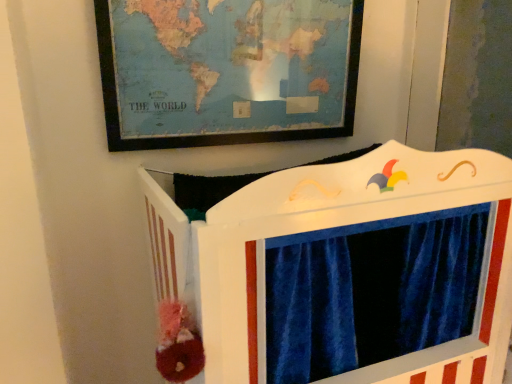
Question: Is the position of wooden world map at upper center more distant than that of white painted wood puppet theater at center?

Choices:
 (A) no
 (B) yes

Answer: (B)

Question: Would you say wooden world map at upper center is outside white painted wood puppet theater at center?

Choices:
 (A) yes
 (B) no

Answer: (A)

Question: From a real-world perspective, is wooden world map at upper center on white painted wood puppet theater at center?

Choices:
 (A) yes
 (B) no

Answer: (A)

Question: Is wooden world map at upper center at the left side of white painted wood puppet theater at center?

Choices:
 (A) no
 (B) yes

Answer: (B)

Question: From a real-world perspective, is wooden world map at upper center physically below white painted wood puppet theater at center?

Choices:
 (A) yes
 (B) no

Answer: (B)

Question: Considering the relative positions of wooden world map at upper center and white painted wood puppet theater at center in the image provided, is wooden world map at upper center to the right of white painted wood puppet theater at center from the viewer's perspective?

Choices:
 (A) yes
 (B) no

Answer: (B)

Question: Considering the relative sizes of white painted wood puppet theater at center and wooden world map at upper center in the image provided, is white painted wood puppet theater at center bigger than wooden world map at upper center?

Choices:
 (A) no
 (B) yes

Answer: (B)

Question: From a real-world perspective, does white painted wood puppet theater at center sit lower than wooden world map at upper center?

Choices:
 (A) no
 (B) yes

Answer: (B)

Question: From the image's perspective, is white painted wood puppet theater at center below wooden world map at upper center?

Choices:
 (A) yes
 (B) no

Answer: (A)

Question: From the image's perspective, is white painted wood puppet theater at center on top of wooden world map at upper center?

Choices:
 (A) no
 (B) yes

Answer: (A)

Question: Are white painted wood puppet theater at center and wooden world map at upper center beside each other?

Choices:
 (A) yes
 (B) no

Answer: (B)

Question: Is white painted wood puppet theater at center positioned before wooden world map at upper center?

Choices:
 (A) yes
 (B) no

Answer: (A)

Question: Considering the positions of white painted wood puppet theater at center and wooden world map at upper center in the image, is white painted wood puppet theater at center wider or thinner than wooden world map at upper center?

Choices:
 (A) thin
 (B) wide

Answer: (B)